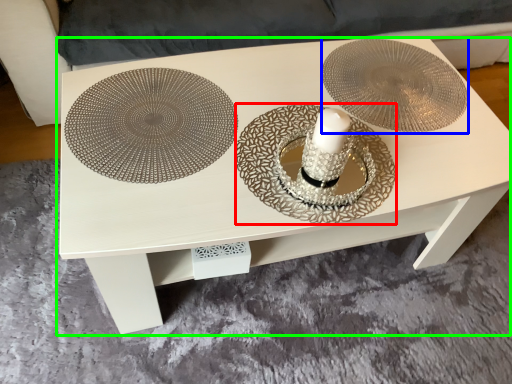
Question: Which is nearer to the plate (highlighted by a red box)? saucer (highlighted by a blue box) or table (highlighted by a green box).

Choices:
 (A) saucer
 (B) table

Answer: (B)